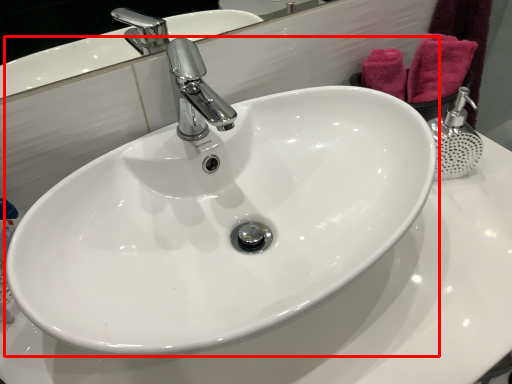
Question: From the image, what is the correct spatial relationship of sink (annotated by the red box) in relation to bath towel?

Choices:
 (A) left
 (B) right

Answer: (A)